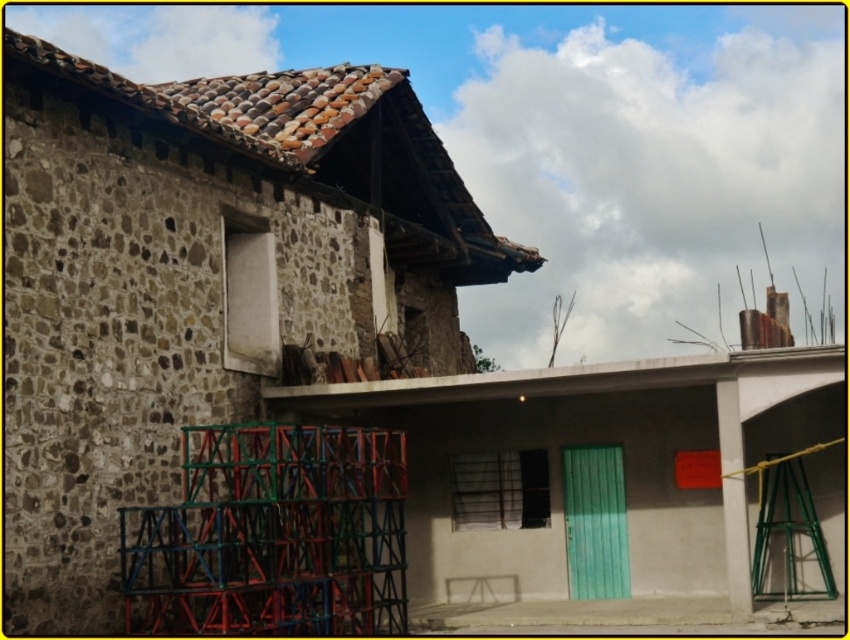
Question: Can you confirm if brown stone wall at left is thinner than metallic scaffolding at left?

Choices:
 (A) yes
 (B) no

Answer: (B)

Question: Which is farther from the metallic scaffolding at left?

Choices:
 (A) smooth concrete hut at center
 (B) brown stone wall at left

Answer: (A)

Question: Is brown stone wall at left thinner than smooth concrete hut at center?

Choices:
 (A) no
 (B) yes

Answer: (B)

Question: Which point appears closest to the camera in this image?

Choices:
 (A) (723, 440)
 (B) (132, 268)
 (C) (316, 429)

Answer: (B)

Question: Is brown stone wall at left thinner than smooth concrete hut at center?

Choices:
 (A) yes
 (B) no

Answer: (A)

Question: Which of the following is the farthest from the observer?

Choices:
 (A) brown stone wall at left
 (B) smooth concrete hut at center
 (C) metallic scaffolding at left

Answer: (B)